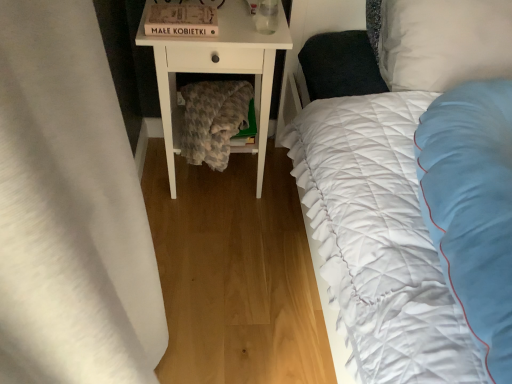
Identify the location of space that is in front of white matte nightstand at center. Image resolution: width=512 pixels, height=384 pixels. (222, 236).